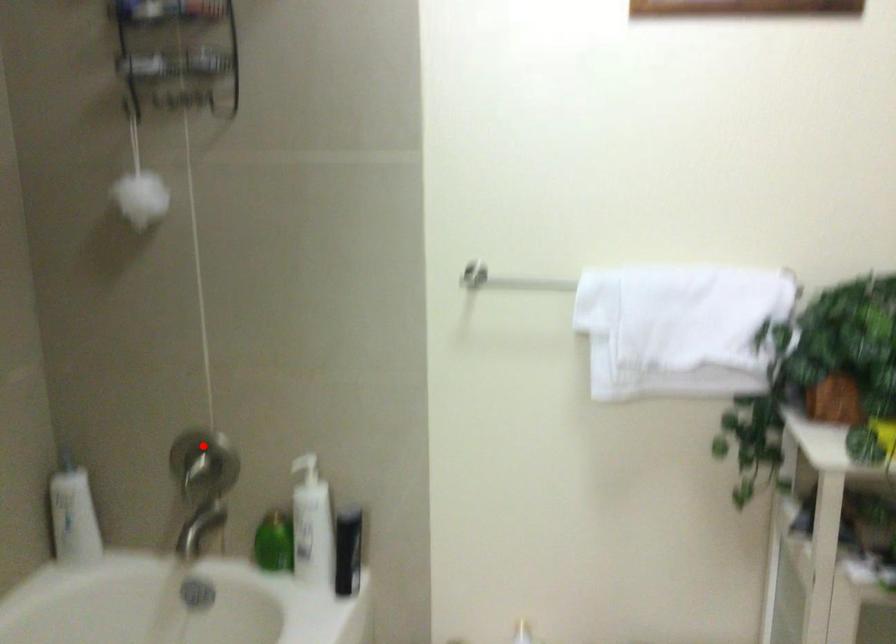
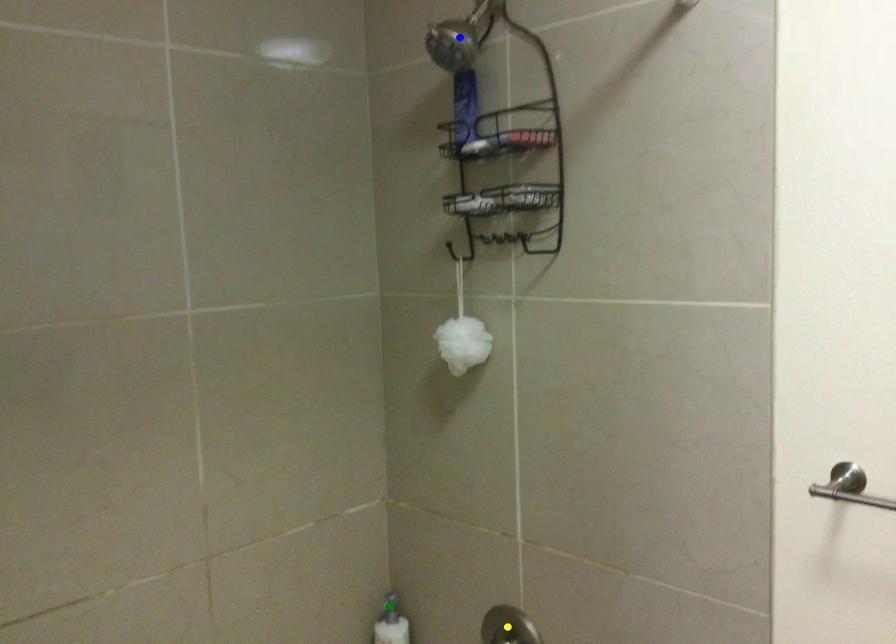
Question: I am providing you with two images of the same scene from different viewpoints. A red point is marked on the first image. You are given multiple points on the second image. Which mark in image 2 goes with the point in image 1?

Choices:
 (A) yellow point
 (B) green point
 (C) blue point

Answer: (A)